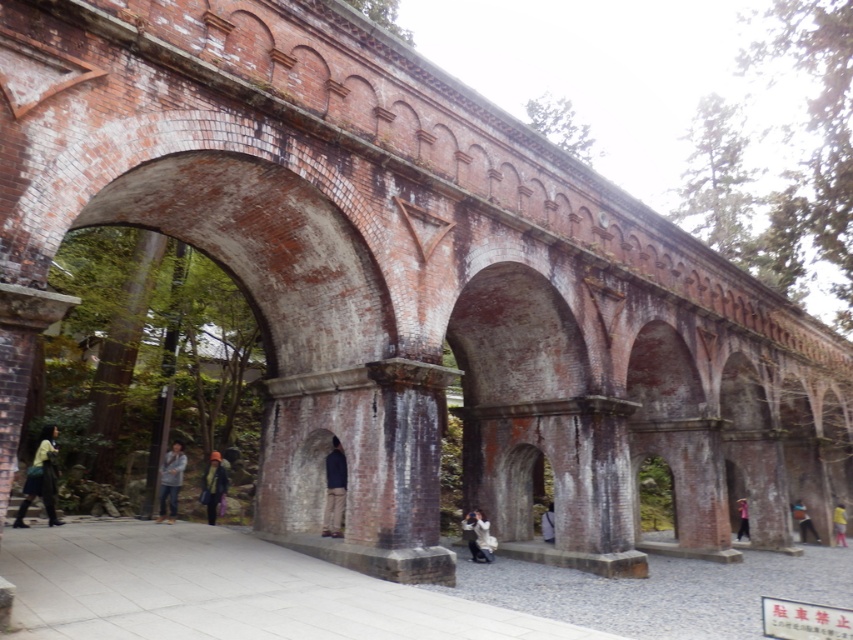
Question: Is the position of green fabric jacket at lower left less distant than that of dark blue jacket at center?

Choices:
 (A) yes
 (B) no

Answer: (B)

Question: Can you confirm if orange knit hat at center is positioned below blue denim jeans at center?

Choices:
 (A) no
 (B) yes

Answer: (A)

Question: Which object is positioned farthest from the light brown leather jacket at center?

Choices:
 (A) green fabric jacket at lower left
 (B) blue denim jeans at center

Answer: (B)

Question: Is orange knit hat at center bigger than blue denim jeans at center?

Choices:
 (A) no
 (B) yes

Answer: (B)

Question: Which object is the farthest from the yellow fabric at center?

Choices:
 (A) light brown leather jacket at lower center
 (B) blue denim jeans at center

Answer: (A)

Question: Which of these objects is positioned closest to the yellow fabric at center?

Choices:
 (A) blue denim jeans at center
 (B) light brown leather jacket at center
 (C) white fabric at center
 (D) light brown leather jacket at lower center

Answer: (A)